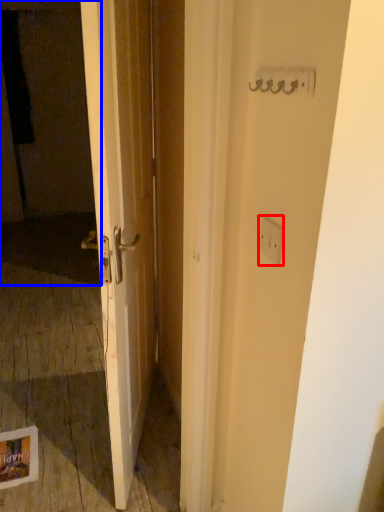
Question: Which object is further to the camera taking this photo, electric outlet (highlighted by a red box) or screen door (highlighted by a blue box)?

Choices:
 (A) electric outlet
 (B) screen door

Answer: (B)